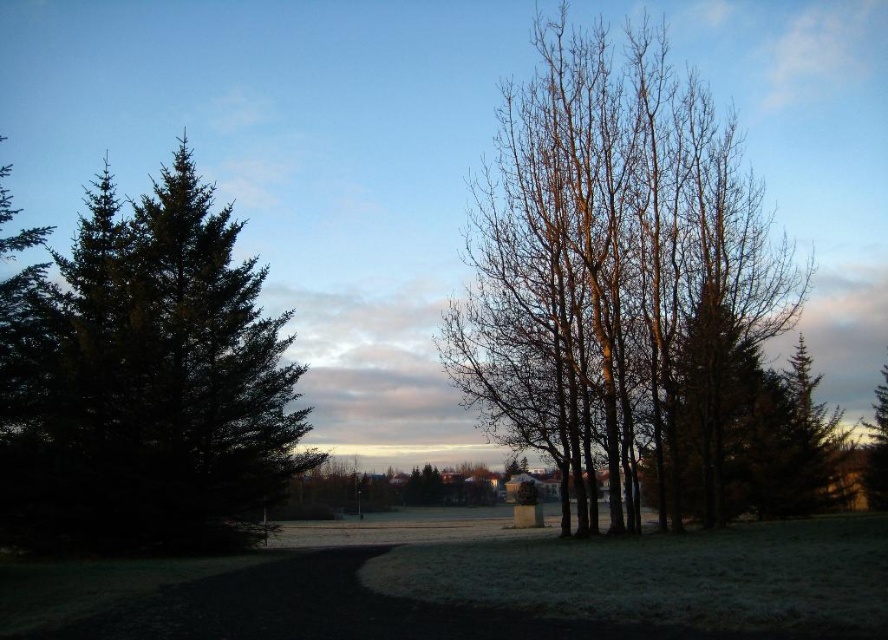
Question: Can you confirm if bare branches at center is smaller than green matte tree at left?

Choices:
 (A) no
 (B) yes

Answer: (A)

Question: Can you confirm if bare branches at center is wider than green matte tree at left?

Choices:
 (A) yes
 (B) no

Answer: (A)

Question: Can you confirm if bare branches at center is positioned to the right of green matte tree at left?

Choices:
 (A) no
 (B) yes

Answer: (B)

Question: Which object appears closest to the camera in this image?

Choices:
 (A) bare branches at center
 (B) green matte tree at left

Answer: (B)

Question: Among these points, which one is farthest from the camera?

Choices:
 (A) pyautogui.click(x=628, y=492)
 (B) pyautogui.click(x=155, y=289)

Answer: (A)

Question: Which of the following is the farthest from the observer?

Choices:
 (A) (188, 493)
 (B) (482, 252)

Answer: (B)